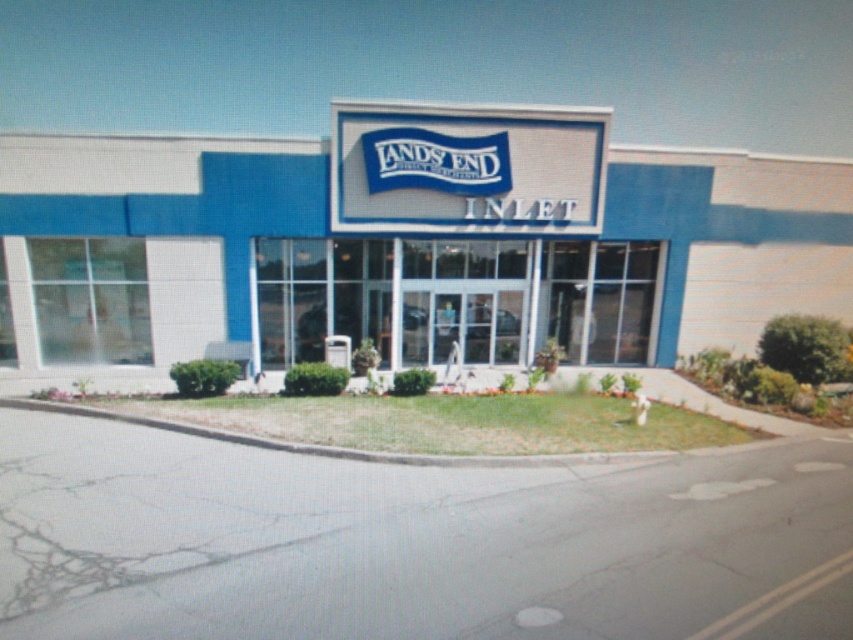
You are standing in front of the Lands End Inlet store and want to take a photo of the white textured building at center and the transparent glass storefront at center. Which object will appear larger in your photo?

The white textured building at center will appear larger in the photo because it is closer to the viewer than the transparent glass storefront at center.

You are a delivery person trying to deliver a package to the Lands End Inlet store. The package requires a secure drop location. The building has a white textured building at center and a transparent glass storefront at center. Which of these two features is closer to where you are standing if you are facing the entrance?

The transparent glass storefront at center is closer to you because it is the front part of the building, while the white textured building at center is set back by 38.53 inches.

You are a customer approaching the Lands End Inlet store. You notice the white textured building at center and the transparent glass storefront at center. Which structure is higher up in the image?

The white textured building at center is located above the transparent glass storefront at center, so it is higher up in the image.